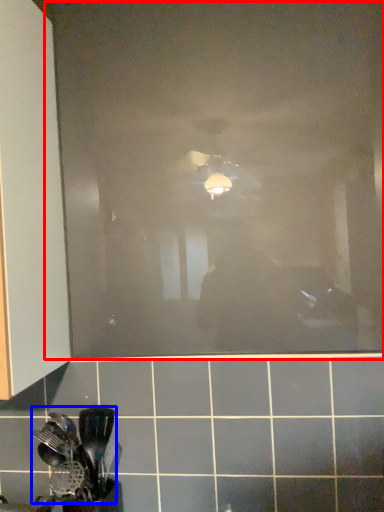
Question: Which point is further to the camera, glass door (highlighted by a red box) or spatula (highlighted by a blue box)?

Choices:
 (A) glass door
 (B) spatula

Answer: (A)